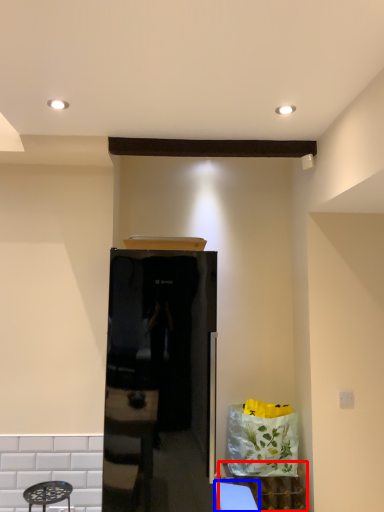
Question: Among these objects, which one is nearest to the camera, cabinetry (highlighted by a red box) or table (highlighted by a blue box)?

Choices:
 (A) cabinetry
 (B) table

Answer: (B)